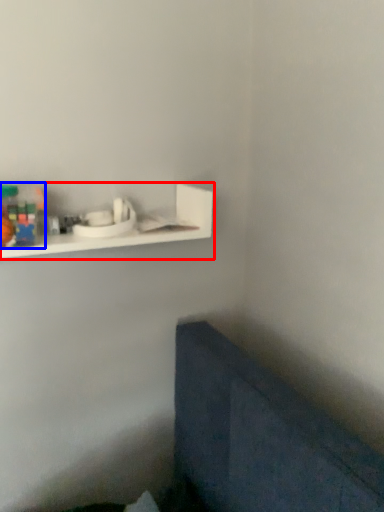
Question: Which object appears farthest to the camera in this image, shelf (highlighted by a red box) or toy (highlighted by a blue box)?

Choices:
 (A) shelf
 (B) toy

Answer: (A)